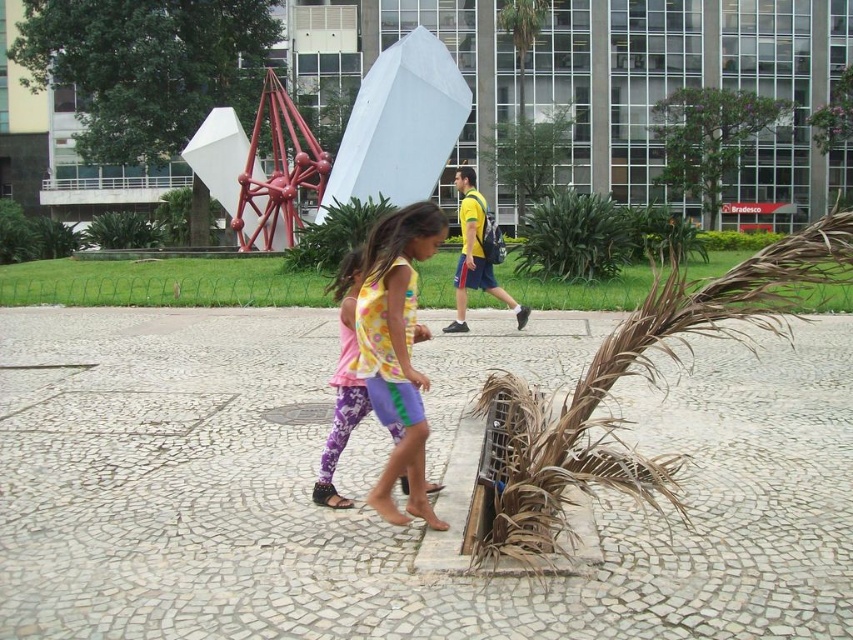
Is multicolored fabric dress at center smaller than brown textured palm tree at upper center?

Yes, multicolored fabric dress at center is smaller than brown textured palm tree at upper center.

Is multicolored fabric dress at center in front of brown textured palm tree at upper center?

Yes, multicolored fabric dress at center is in front of brown textured palm tree at upper center.

Locate an element on the screen. The height and width of the screenshot is (640, 853). multicolored fabric dress at center is located at coordinates (341, 381).

Where is `multicolored fabric dress at center`? multicolored fabric dress at center is located at coordinates (341, 381).

Does brown dried palm at lower right appear on the right side of brown textured palm tree at upper center?

Correct, you'll find brown dried palm at lower right to the right of brown textured palm tree at upper center.

Measure the distance between brown dried palm at lower right and camera.

19.19 feet

This screenshot has width=853, height=640. Find the location of `brown dried palm at lower right`. brown dried palm at lower right is located at coordinates (630, 374).

Looking at this image, is brown dried palm at lower right thinner than multicolored fabric dress at center?

Incorrect, brown dried palm at lower right's width is not less than multicolored fabric dress at center's.

Is point (635, 346) positioned after point (364, 404)?

No.

Find the location of a particular element. The height and width of the screenshot is (640, 853). brown dried palm at lower right is located at coordinates (630, 374).